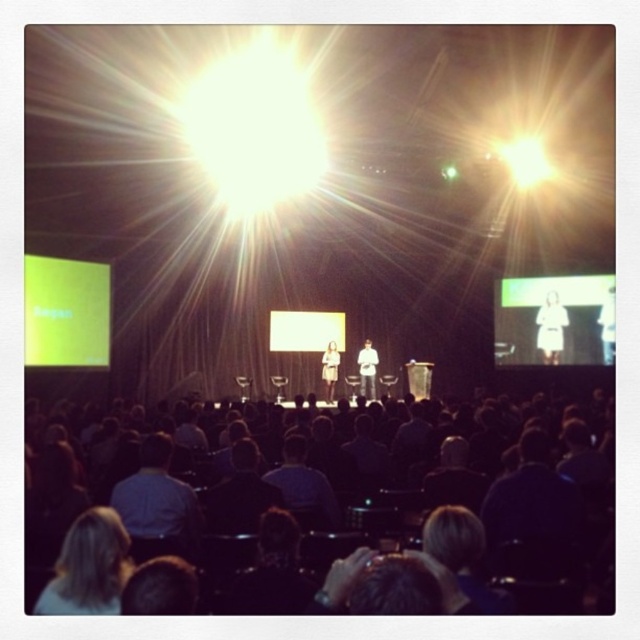
Is point (32, 275) positioned before point (368, 385)?

Yes, it is in front of point (368, 385).

Who is lower down, green matte projection screen at left or white fabric shirt at center?

Positioned lower is white fabric shirt at center.

I want to click on green matte projection screen at left, so click(x=65, y=312).

You are a GUI agent. You are given a task and a screenshot of the screen. Output one action in this format:
    pyautogui.click(x=<x>, y=<y>)
    Task: Click on the green matte projection screen at left
    This screenshot has height=640, width=640.
    Given the screenshot: What is the action you would take?
    pyautogui.click(x=65, y=312)

Which is in front, point (291, 464) or point (326, 371)?

Point (291, 464) is in front.

Does dark blue shirt at center have a greater width compared to white fabric at center?

Yes.

Locate an element on the screen. The height and width of the screenshot is (640, 640). dark blue shirt at center is located at coordinates (305, 486).

At what (x,y) coordinates should I click in order to perform the action: click on dark blue shirt at center. Please return your answer as a coordinate pair (x, y). Looking at the image, I should click on coord(305,486).

Does green matte projection screen at left come behind blue shirt at center?

Yes.

Is green matte projection screen at left closer to the viewer compared to blue shirt at center?

No.

Measure the distance between point (93, 301) and camera.

16.89 meters

This screenshot has height=640, width=640. I want to click on green matte projection screen at left, so click(x=65, y=312).